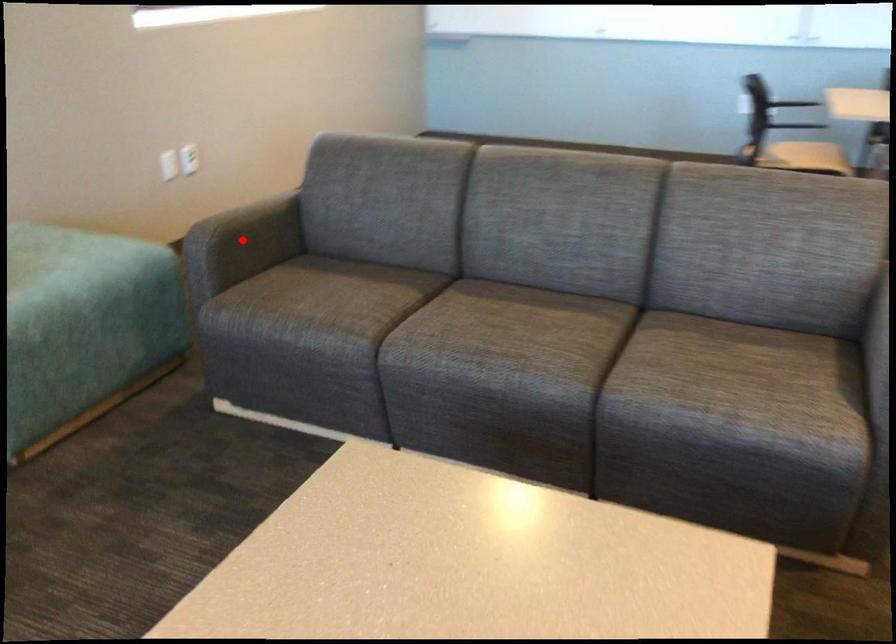
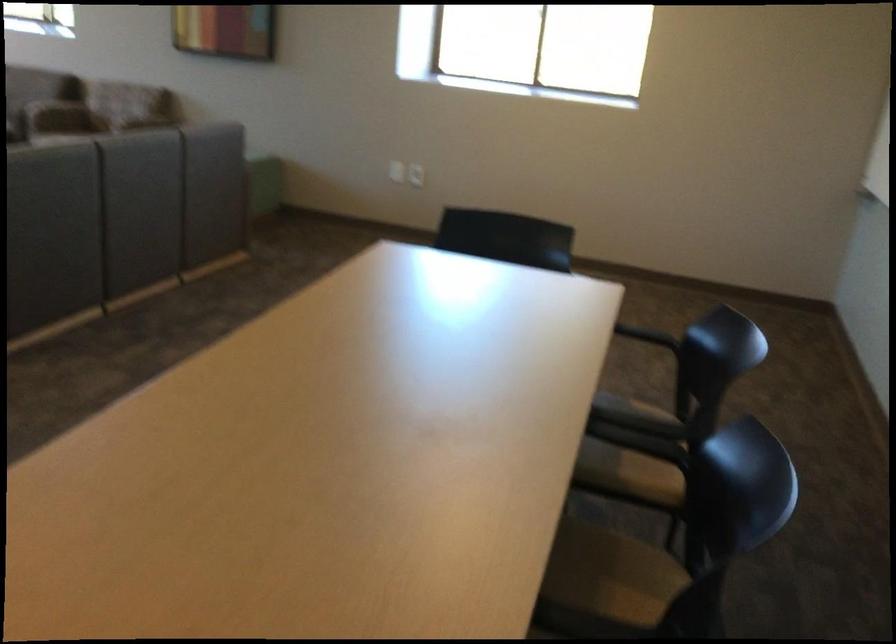
Question: I am providing you with two images of the same scene from different viewpoints. A red point is marked on the first image. Is the red point's position out of view in image 2?

Choices:
 (A) Yes
 (B) No

Answer: (A)